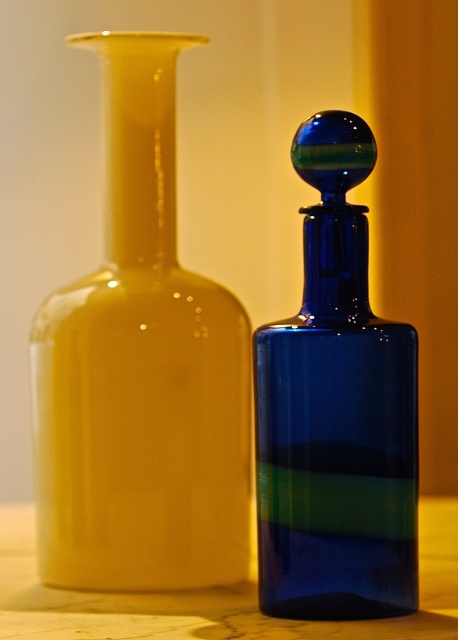
Question: Does matte yellow glass vase at left lie behind wooden table at center?

Choices:
 (A) yes
 (B) no

Answer: (A)

Question: Is blue glass bottle at center positioned in front of wooden table at center?

Choices:
 (A) yes
 (B) no

Answer: (B)

Question: Which object is positioned farthest from the wooden table at center?

Choices:
 (A) blue glass bottle at center
 (B) matte yellow glass vase at left

Answer: (A)

Question: Which is farther from the wooden table at center?

Choices:
 (A) blue glass bottle at center
 (B) matte yellow glass vase at left

Answer: (A)

Question: Estimate the real-world distances between objects in this image. Which object is closer to the matte yellow glass vase at left?

Choices:
 (A) wooden table at center
 (B) blue glass bottle at center

Answer: (B)

Question: Is the position of matte yellow glass vase at left less distant than that of wooden table at center?

Choices:
 (A) no
 (B) yes

Answer: (A)